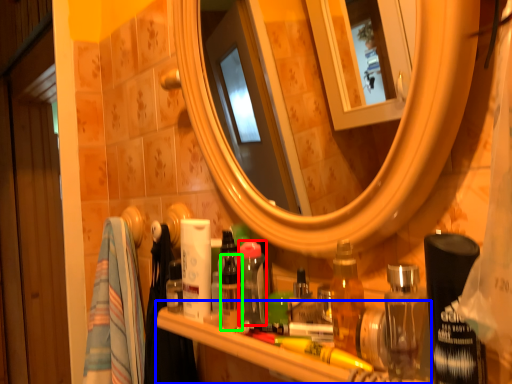
Question: Based on their relative distances, which object is farther from toiletry (highlighted by a red box)? Choose from counter (highlighted by a blue box) and toiletry (highlighted by a green box).

Choices:
 (A) counter
 (B) toiletry

Answer: (A)